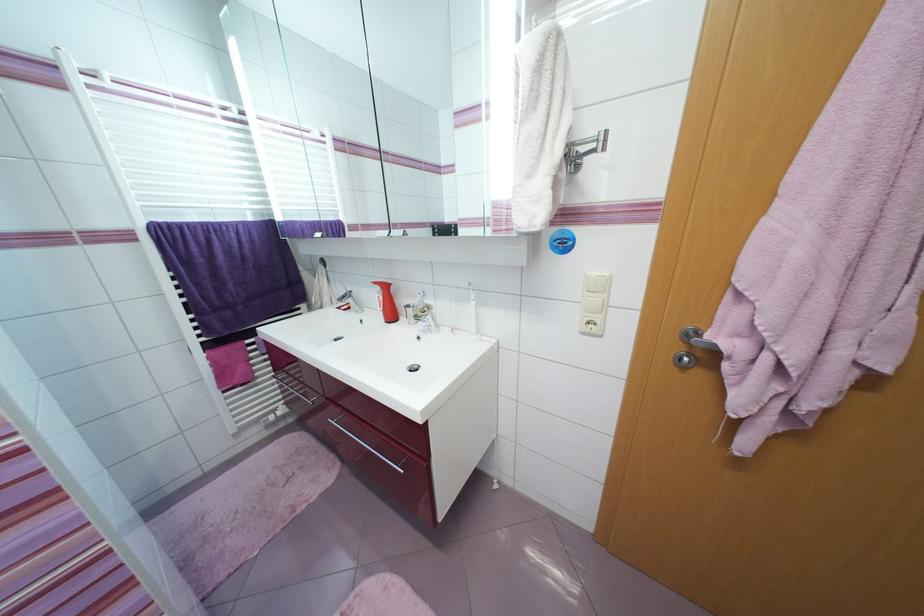
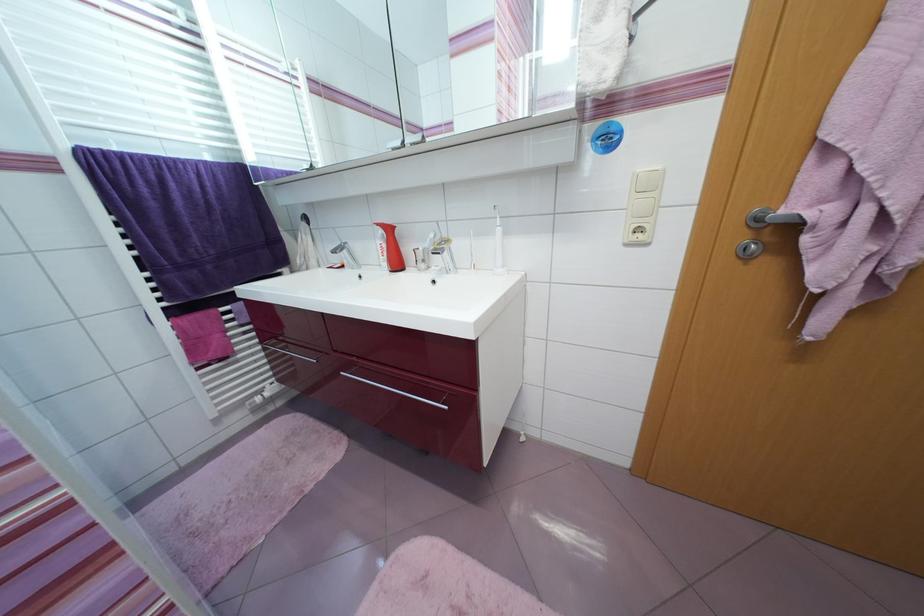
Where in the second image is the point corresponding to the point at 414,307 from the first image?

(423, 251)